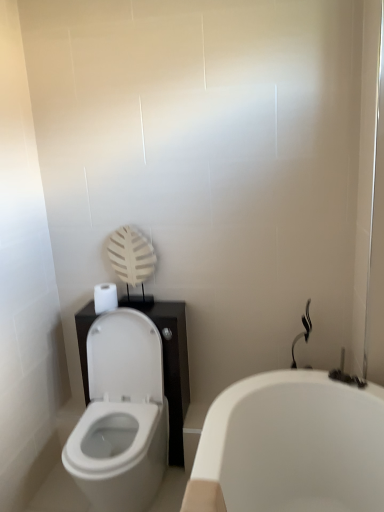
Question: Is white glossy toilet at lower left inside the boundaries of black glossy shower at right, or outside?

Choices:
 (A) inside
 (B) outside

Answer: (B)

Question: From a real-world perspective, is white glossy toilet at lower left physically located above or below black glossy shower at right?

Choices:
 (A) above
 (B) below

Answer: (B)

Question: Which object is positioned closest to the white matte toilet paper at left?

Choices:
 (A) black glossy shower at right
 (B) white glossy toilet at lower left
 (C) white glossy bathtub at lower right

Answer: (B)

Question: Which is nearer to the black glossy shower at right?

Choices:
 (A) white glossy bathtub at lower right
 (B) white matte toilet paper at left
 (C) white glossy toilet at lower left

Answer: (A)